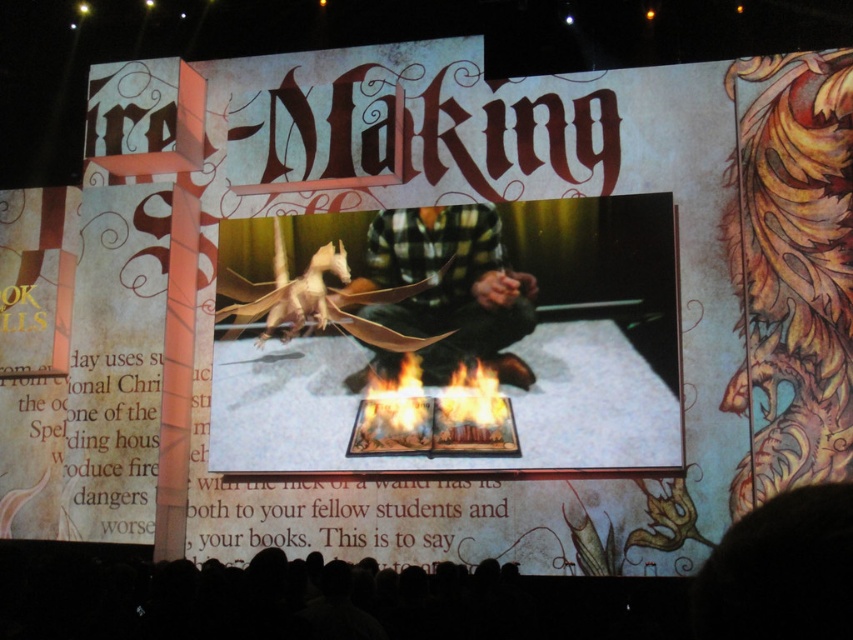
Between point (566, 266) and point (486, 392), which one is positioned behind?

Positioned behind is point (566, 266).

Is paper dragon at center to the left of flametransparentbook at center from the viewer's perspective?

Indeed, paper dragon at center is positioned on the left side of flametransparentbook at center.

I want to click on paper dragon at center, so click(x=439, y=339).

Is point (637, 385) less distant than point (396, 356)?

That is True.

What are the coordinates of `paper dragon at center` in the screenshot? It's located at (439, 339).

What do you see at coordinates (450, 288) in the screenshot? I see `green plaid shirt at center` at bounding box center [450, 288].

From the picture: Can you confirm if green plaid shirt at center is shorter than flametransparentbook at center?

No, green plaid shirt at center is not shorter than flametransparentbook at center.

Is point (397, 321) positioned before point (392, 388)?

No, it is not.

This screenshot has height=640, width=853. I want to click on green plaid shirt at center, so click(450, 288).